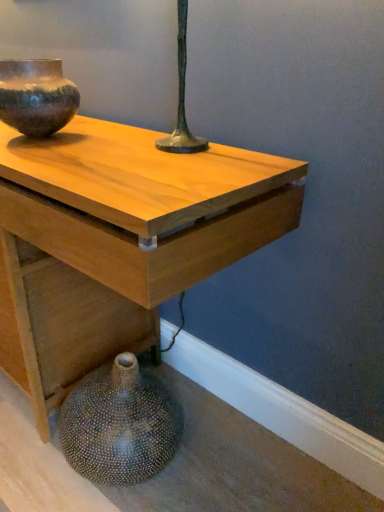
The height and width of the screenshot is (512, 384). What are the coordinates of `unoccupied area in front of rustic ceramic vase at upper left, positioned as the 1th vase in top-to-bottom order` in the screenshot? It's located at pyautogui.click(x=40, y=154).